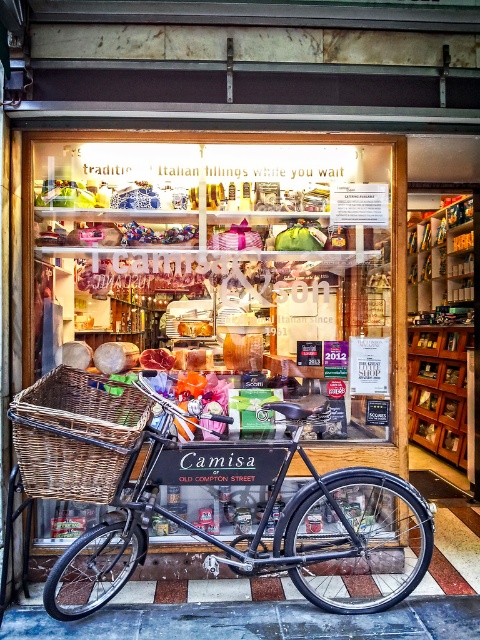
At what (x,y) coordinates should I click in order to perform the action: click on matte black bicycle at center. Please return your answer as a coordinate pair (x, y). This screenshot has width=480, height=640. Looking at the image, I should click on (259, 522).

Who is more forward, (348, 538) or (117, 477)?

Point (117, 477)

Find the location of a particular element. The width and height of the screenshot is (480, 640). matte black bicycle at center is located at coordinates (259, 522).

Does wooden crate at center appear on the right side of matte black bicycle at center?

No, wooden crate at center is not to the right of matte black bicycle at center.

Does wooden crate at center have a larger size compared to matte black bicycle at center?

Correct, wooden crate at center is larger in size than matte black bicycle at center.

Does point (61, 218) come behind point (354, 490)?

Yes, point (61, 218) is farther from viewer.

Where is `wooden crate at center`? The height and width of the screenshot is (640, 480). wooden crate at center is located at coordinates (227, 262).

Between point (186, 356) and point (84, 403), which one is positioned in front?

Point (84, 403) is more forward.

The width and height of the screenshot is (480, 640). Find the location of `wooden crate at center`. wooden crate at center is located at coordinates (227, 262).